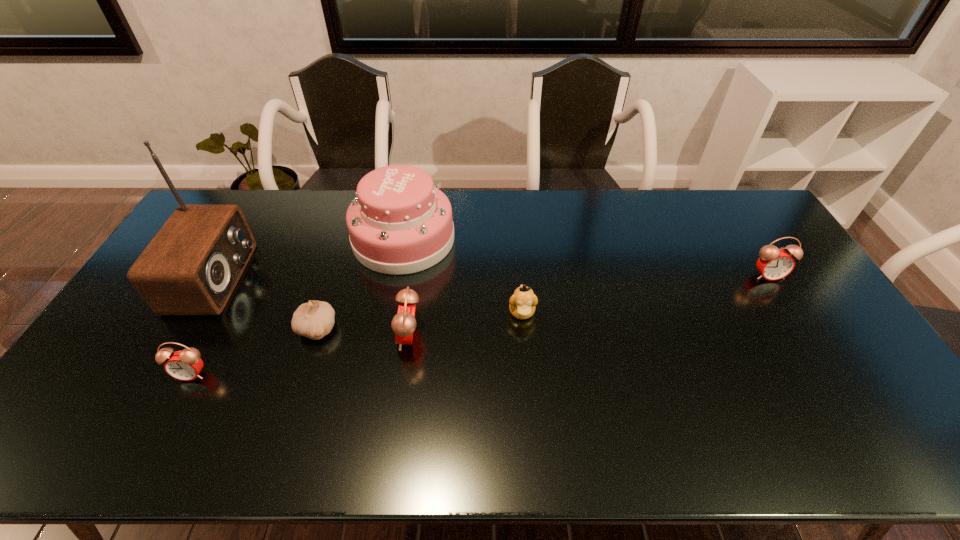
Locate an element on the screen. Image resolution: width=960 pixels, height=540 pixels. object that is positioned at the left edge is located at coordinates (192, 265).

Where is `object present at the right edge`? The height and width of the screenshot is (540, 960). object present at the right edge is located at coordinates (774, 264).

Where is `free space at the far edge`? This screenshot has width=960, height=540. free space at the far edge is located at coordinates (501, 221).

Find the location of a particular element. The width and height of the screenshot is (960, 540). vacant space at the near edge of the desktop is located at coordinates (811, 402).

Where is `free space at the right edge`? free space at the right edge is located at coordinates (790, 335).

This screenshot has height=540, width=960. In the image, there is a desktop. What are the coordinates of `vacant space at the near right corner` in the screenshot? It's located at pos(830,384).

Locate an element on the screen. This screenshot has width=960, height=540. vacant point located between the sixth object from left to right and the nearest alarm clock is located at coordinates (357, 343).

At what (x,y) coordinates should I click in order to perform the action: click on free space between the second object from right to left and the second shortest alarm clock. Please return your answer as a coordinate pair (x, y). The width and height of the screenshot is (960, 540). Looking at the image, I should click on [x=645, y=294].

What are the coordinates of `free space between the second nearest alarm clock and the second object from right to left` in the screenshot? It's located at pyautogui.click(x=466, y=325).

At what (x,y) coordinates should I click in order to perform the action: click on free space between the second tallest alarm clock and the second tallest object. Please return your answer as a coordinate pair (x, y). The width and height of the screenshot is (960, 540). Looking at the image, I should click on (586, 257).